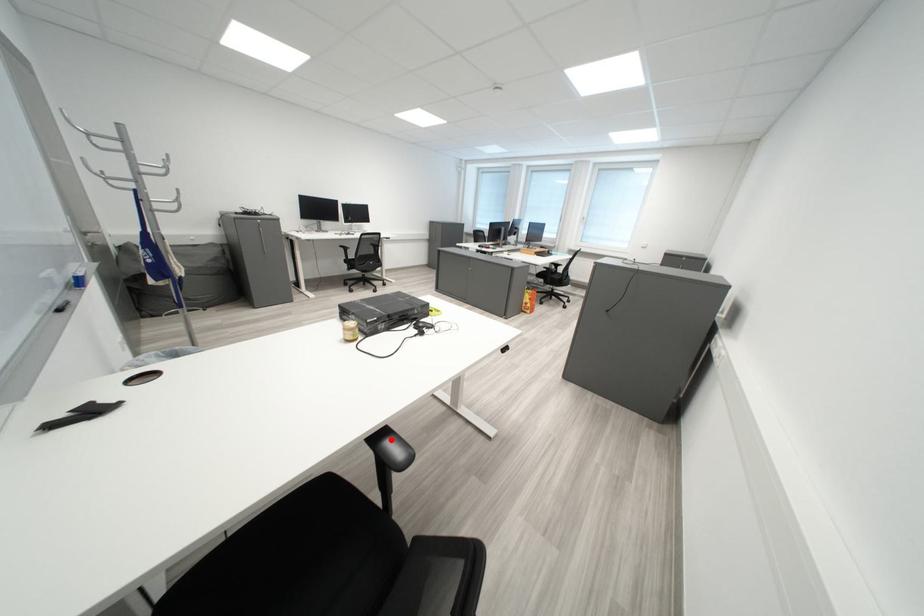
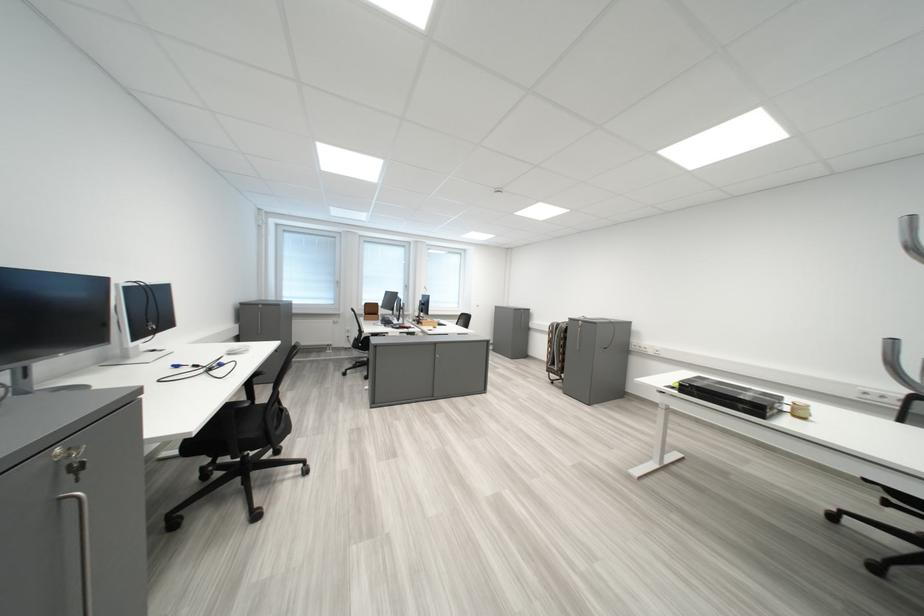
Question: I am providing you with two images of the same scene from different viewpoints. A red point is marked on the first image. Can you still see the location of the red point in image 2?

Choices:
 (A) Yes
 (B) No

Answer: (B)